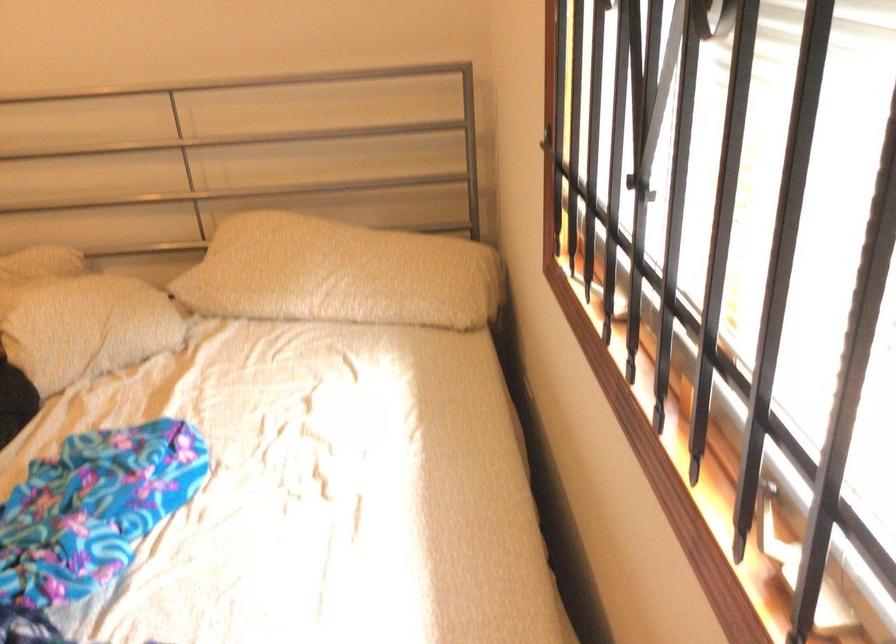
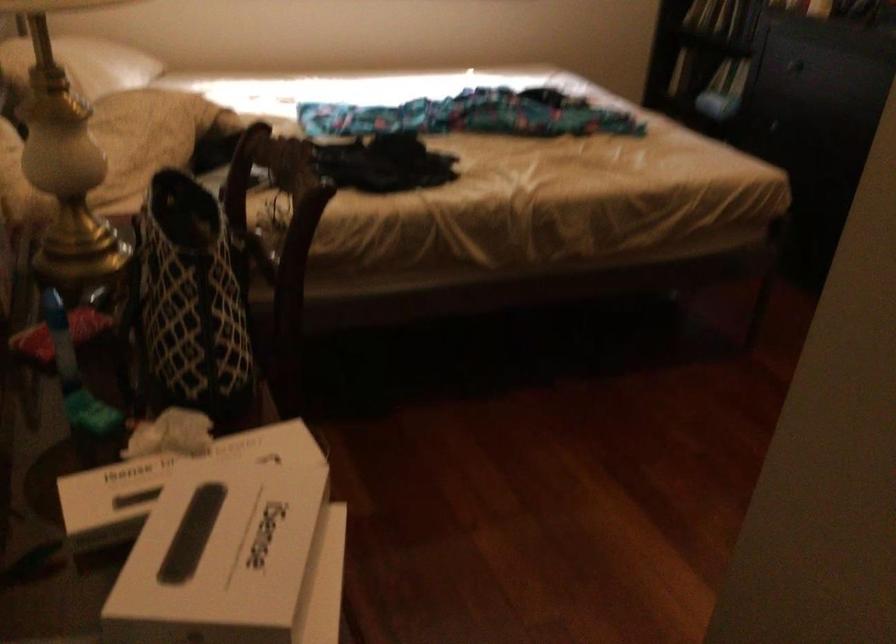
Find the pixel in the second image that matches point (240, 259) in the first image.

(82, 64)